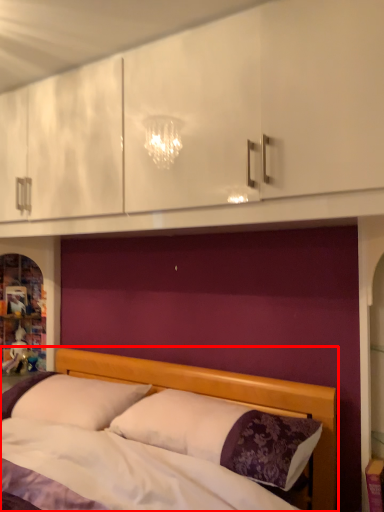
Question: Considering the relative positions of bed (annotated by the red box) and pillow in the image provided, where is bed (annotated by the red box) located with respect to the staircase?

Choices:
 (A) left
 (B) right

Answer: (B)